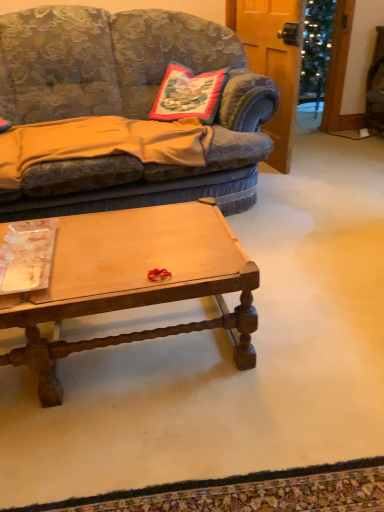
You are a GUI agent. You are given a task and a screenshot of the screen. Output one action in this format:
    pyautogui.click(x=<x>, y=<y>)
    Task: Click on the free point above light brown wood coffee table at center (from a real-world perspective)
    
    Given the screenshot: What is the action you would take?
    pyautogui.click(x=108, y=243)